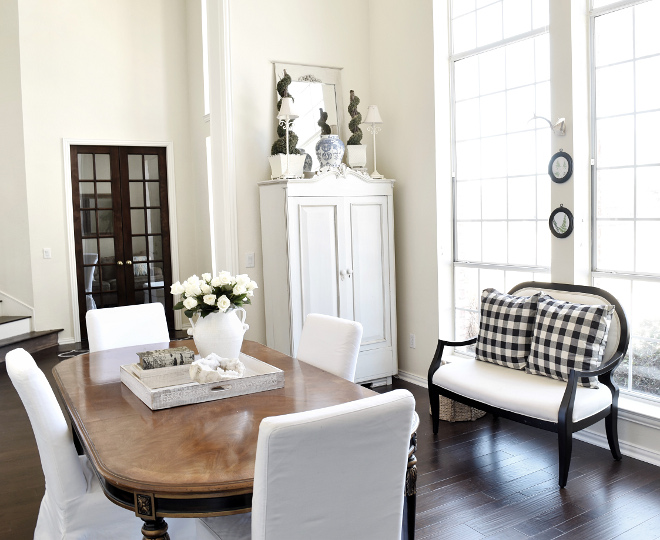
This screenshot has width=660, height=540. I want to click on tray, so click(213, 378).